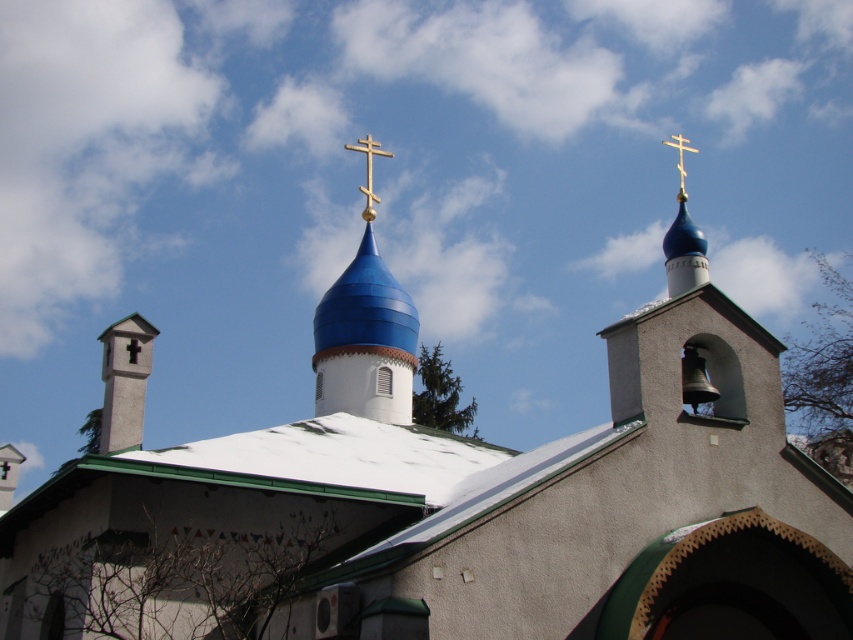
You are a photographer planning to capture the golden cross atop the domes of this church. Given that the golden cross is located at point (368, 172), which is the upper center of the image, where should you position your camera to ensure it is centered in your shot?

The golden cross is located at the upper center of the image, so positioning the camera directly facing the upper center will center it in the shot.